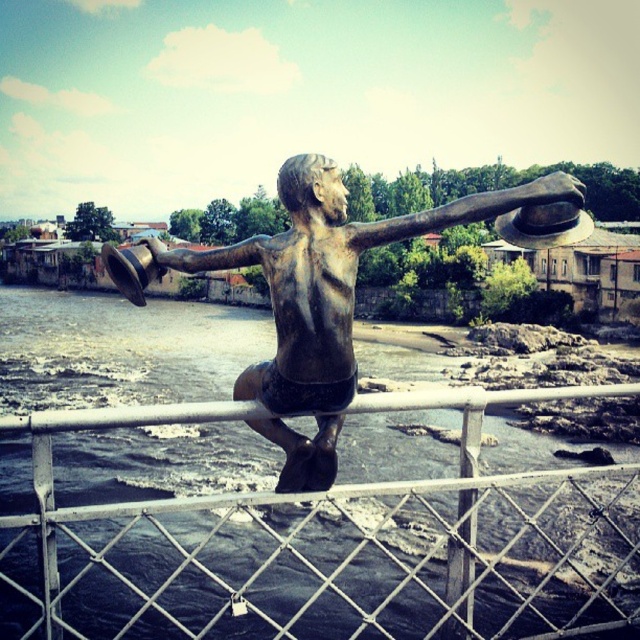
Question: Which point is farther to the camera?

Choices:
 (A) bronze statue at center
 (B) white metal fence at center

Answer: (B)

Question: Does white metal fence at center appear on the left side of bronze statue at center?

Choices:
 (A) yes
 (B) no

Answer: (A)

Question: Is white metal fence at center below bronze statue at center?

Choices:
 (A) yes
 (B) no

Answer: (A)

Question: Which of the following is the farthest from the observer?

Choices:
 (A) white metal fence at center
 (B) bronze statue at center

Answer: (A)

Question: In this image, where is white metal fence at center located relative to bronze statue at center?

Choices:
 (A) left
 (B) right

Answer: (A)